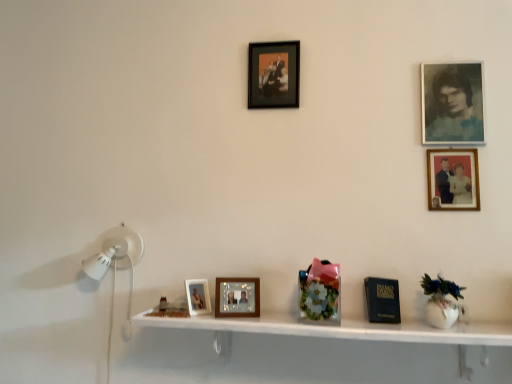
How much space does blue-toned paper photo frame at upper right, which ranks as the fifth picture frame in left-to-right order, occupy vertically?

33.59 centimeters.

You are a GUI agent. You are given a task and a screenshot of the screen. Output one action in this format:
    pyautogui.click(x=<x>, y=<y>)
    Task: Click on the wooden photo frame at center, the 4th picture frame when ordered from right to left
    
    Given the screenshot: What is the action you would take?
    pyautogui.click(x=237, y=297)

Describe the element at coordinates (341, 329) in the screenshot. The width and height of the screenshot is (512, 384). I see `white glossy shelf at lower center` at that location.

In the scene shown: Measure the distance between matte wooden picture frame at center, the 1th picture frame positioned from the bottom, and camera.

matte wooden picture frame at center, the 1th picture frame positioned from the bottom, is 4.92 feet from camera.

Describe the element at coordinates (320, 291) in the screenshot. Image resolution: width=512 pixels, height=384 pixels. I see `floral-patterned glass vase at center` at that location.

Based on the photo, what is the approximate width of floral-patterned glass vase at center?

5.87 inches.

At what (x,y) coordinates should I click in order to perform the action: click on wooden picture frame at upper right, the third picture frame from the top. Please return your answer as a coordinate pair (x, y). This screenshot has width=512, height=384. Looking at the image, I should click on (453, 179).

From the image's perspective, which object appears higher, floral-patterned glass vase at center or matte wooden picture frame at center, placed as the first picture frame when sorted from left to right?

floral-patterned glass vase at center, from the image's perspective.

Which is farther from the camera, (335,277) or (192,284)?

The point (192,284) is more distant.

Find the location of a particular element. the 3rd picture frame to the left when counting from the floral-patterned glass vase at center is located at coordinates (198, 296).

From the picture: Could you tell me if floral-patterned glass vase at center is facing matte wooden picture frame at center, the fifth picture frame when ordered from top to bottom?

No, floral-patterned glass vase at center is not aimed at matte wooden picture frame at center, the fifth picture frame when ordered from top to bottom.

Based on the photo, does wooden photo frame at center, which is counted as the 2th picture frame, starting from the bottom, have a smaller size compared to matte black picture frame at upper center, marked as the first picture frame in a top-to-bottom arrangement?

Indeed, wooden photo frame at center, which is counted as the 2th picture frame, starting from the bottom, has a smaller size compared to matte black picture frame at upper center, marked as the first picture frame in a top-to-bottom arrangement.

Which point is more distant from viewer, (257, 314) or (291, 86)?

The point (291, 86) is farther.

From the image's perspective, is wooden photo frame at center, the 4th picture frame when ordered from right to left, on matte black picture frame at upper center, marked as the first picture frame in a top-to-bottom arrangement?

Incorrect, from the image's perspective, wooden photo frame at center, the 4th picture frame when ordered from right to left, is lower than matte black picture frame at upper center, marked as the first picture frame in a top-to-bottom arrangement.

Does matte wooden picture frame at center, placed as the first picture frame when sorted from left to right, have a greater height compared to white glossy shelf at lower center?

In fact, matte wooden picture frame at center, placed as the first picture frame when sorted from left to right, may be shorter than white glossy shelf at lower center.

Visually, is matte wooden picture frame at center, the fifth picture frame when ordered from top to bottom, positioned to the left or to the right of white glossy shelf at lower center?

Clearly, matte wooden picture frame at center, the fifth picture frame when ordered from top to bottom, is on the left of white glossy shelf at lower center in the image.

From a real-world perspective, which object stands above the other?

matte wooden picture frame at center, placed as the first picture frame when sorted from left to right.

Is the surface of matte wooden picture frame at center, placed as the first picture frame when sorted from left to right, in direct contact with white glossy shelf at lower center?

matte wooden picture frame at center, placed as the first picture frame when sorted from left to right, is not next to white glossy shelf at lower center, and they're not touching.

Considering the relative sizes of wooden photo frame at center, which is counted as the 2th picture frame, starting from the bottom, and wooden picture frame at upper right, which is the second picture frame from right to left, in the image provided, is wooden photo frame at center, which is counted as the 2th picture frame, starting from the bottom, smaller than wooden picture frame at upper right, which is the second picture frame from right to left,?

No.

Is wooden photo frame at center, the 4th picture frame when ordered from right to left, thinner than wooden picture frame at upper right, the third picture frame from the top?

No, wooden photo frame at center, the 4th picture frame when ordered from right to left, is not thinner than wooden picture frame at upper right, the third picture frame from the top.

Locate an element on the screen. Image resolution: width=512 pixels, height=384 pixels. the 1st picture frame positioned below the wooden picture frame at upper right, which appears as the fourth picture frame when viewed from the left (from the image's perspective) is located at coordinates (237, 297).

Is wooden photo frame at center, which is the 4th picture frame from top to bottom, at the left side of wooden picture frame at upper right, marked as the third picture frame in a bottom-to-top arrangement?

Yes.

Is wooden photo frame at center, the second picture frame in the left-to-right sequence, outside of matte wooden picture frame at center, the 1th picture frame positioned from the bottom?

Yes, wooden photo frame at center, the second picture frame in the left-to-right sequence, is not within matte wooden picture frame at center, the 1th picture frame positioned from the bottom.

Which object is further away from the camera taking this photo, wooden photo frame at center, which is counted as the 2th picture frame, starting from the bottom, or matte wooden picture frame at center, which is the 5th picture frame in right-to-left order?

matte wooden picture frame at center, which is the 5th picture frame in right-to-left order, is behind.

Are wooden photo frame at center, which is counted as the 2th picture frame, starting from the bottom, and matte wooden picture frame at center, placed as the first picture frame when sorted from left to right, beside each other?

No, wooden photo frame at center, which is counted as the 2th picture frame, starting from the bottom, is not touching matte wooden picture frame at center, placed as the first picture frame when sorted from left to right.

Could you tell me if wooden photo frame at center, the second picture frame in the left-to-right sequence, is facing matte wooden picture frame at center, which is the 5th picture frame in right-to-left order?

No.

From the picture: From the image's perspective, between wooden photo frame at center, the second picture frame in the left-to-right sequence, and floral-patterned glass vase at center, which one is located above?

floral-patterned glass vase at center, from the image's perspective.

Can floral-patterned glass vase at center be found inside wooden photo frame at center, the 4th picture frame when ordered from right to left?

No, floral-patterned glass vase at center is located outside of wooden photo frame at center, the 4th picture frame when ordered from right to left.

Between wooden photo frame at center, which is counted as the 2th picture frame, starting from the bottom, and floral-patterned glass vase at center, which one has less height?

wooden photo frame at center, which is counted as the 2th picture frame, starting from the bottom, is shorter.

From a real-world perspective, which is physically below, wooden photo frame at center, which is counted as the 2th picture frame, starting from the bottom, or floral-patterned glass vase at center?

wooden photo frame at center, which is counted as the 2th picture frame, starting from the bottom, is physically lower.

Does wooden picture frame at upper right, which is the second picture frame from right to left, touch matte black picture frame at upper center, arranged as the fifth picture frame when ordered from the bottom?

They are not placed beside each other.

Considering the positions of objects wooden picture frame at upper right, the third picture frame from the top, and matte black picture frame at upper center, the 3th picture frame in the right-to-left sequence, in the image provided, who is behind, wooden picture frame at upper right, the third picture frame from the top, or matte black picture frame at upper center, the 3th picture frame in the right-to-left sequence,?

matte black picture frame at upper center, the 3th picture frame in the right-to-left sequence, is more distant.

I want to click on picture frame that is the 1st object to the left of the wooden picture frame at upper right, the third picture frame from the top, starting at the anchor, so click(274, 74).

There is a floral-patterned glass vase at center. Find the location of `the 2nd picture frame below it (from a real-world perspective)`. the 2nd picture frame below it (from a real-world perspective) is located at coordinates (198, 296).

From the matte black picture frame at upper center, the 3th picture frame in the right-to-left sequence, count 4th picture frames forward and point to it. Please provide its 2D coordinates.

[(237, 297)]

Looking at the image, which one is located further to wooden picture frame at upper right, the third picture frame from the top, white glossy shelf at lower center or floral-patterned glass vase at center?

Based on the image, white glossy shelf at lower center appears to be further to wooden picture frame at upper right, the third picture frame from the top.

When comparing their distances from matte black picture frame at upper center, the 3th picture frame when ordered from left to right, does matte wooden picture frame at center, placed as the first picture frame when sorted from left to right, or wooden picture frame at upper right, which appears as the fourth picture frame when viewed from the left, seem closer?

wooden picture frame at upper right, which appears as the fourth picture frame when viewed from the left, is positioned closer to the anchor matte black picture frame at upper center, the 3th picture frame when ordered from left to right.

Looking at the image, which one is located further to wooden picture frame at upper right, the third picture frame from the top, wooden photo frame at center, which is the 4th picture frame from top to bottom, or blue-toned paper photo frame at upper right, which ranks as the fifth picture frame in left-to-right order?

wooden photo frame at center, which is the 4th picture frame from top to bottom, lies further to wooden picture frame at upper right, the third picture frame from the top, than the other object.

From the image, which object appears to be farther from blue-toned paper photo frame at upper right, the second picture frame in the top-to-bottom sequence, matte wooden picture frame at center, placed as the first picture frame when sorted from left to right, or floral-patterned glass vase at center?

matte wooden picture frame at center, placed as the first picture frame when sorted from left to right.

Looking at this image, based on their spatial positions, is wooden picture frame at upper right, which is the second picture frame from right to left, or blue-toned paper photo frame at upper right, the fourth picture frame in the bottom-to-top sequence, closer to matte black picture frame at upper center, the 3th picture frame in the right-to-left sequence?

blue-toned paper photo frame at upper right, the fourth picture frame in the bottom-to-top sequence, lies closer to matte black picture frame at upper center, the 3th picture frame in the right-to-left sequence, than the other object.

Considering their positions, is matte wooden picture frame at center, placed as the first picture frame when sorted from left to right, positioned further to white glossy shelf at lower center than wooden photo frame at center, the 4th picture frame when ordered from right to left?

matte wooden picture frame at center, placed as the first picture frame when sorted from left to right, is positioned further to the anchor white glossy shelf at lower center.

Which object lies further to the anchor point wooden picture frame at upper right, which appears as the fourth picture frame when viewed from the left, blue-toned paper photo frame at upper right, which ranks as the fifth picture frame in left-to-right order, or floral-patterned glass vase at center?

The object further to wooden picture frame at upper right, which appears as the fourth picture frame when viewed from the left, is floral-patterned glass vase at center.

Based on their spatial positions, is matte wooden picture frame at center, which is the 5th picture frame in right-to-left order, or matte black picture frame at upper center, the 3th picture frame in the right-to-left sequence, closer to wooden picture frame at upper right, which appears as the fourth picture frame when viewed from the left?

matte black picture frame at upper center, the 3th picture frame in the right-to-left sequence, is positioned closer to the anchor wooden picture frame at upper right, which appears as the fourth picture frame when viewed from the left.

Find the location of a particular element. This screenshot has height=384, width=512. art between matte black picture frame at upper center, the 3th picture frame when ordered from left to right, and matte wooden picture frame at center, the 1th picture frame positioned from the bottom, in the vertical direction is located at coordinates (320, 291).

At what (x,y) coordinates should I click in order to perform the action: click on art between wooden photo frame at center, which is the 4th picture frame from top to bottom, and wooden picture frame at upper right, marked as the third picture frame in a bottom-to-top arrangement. Please return your answer as a coordinate pair (x, y). This screenshot has width=512, height=384. Looking at the image, I should click on (320, 291).

Find the location of a particular element. art between matte black picture frame at upper center, arranged as the fifth picture frame when ordered from the bottom, and white glossy shelf at lower center, in the vertical direction is located at coordinates (320, 291).

Find the location of a particular element. This screenshot has height=384, width=512. art between matte black picture frame at upper center, the 3th picture frame in the right-to-left sequence, and wooden photo frame at center, the second picture frame in the left-to-right sequence, in the vertical direction is located at coordinates (320, 291).